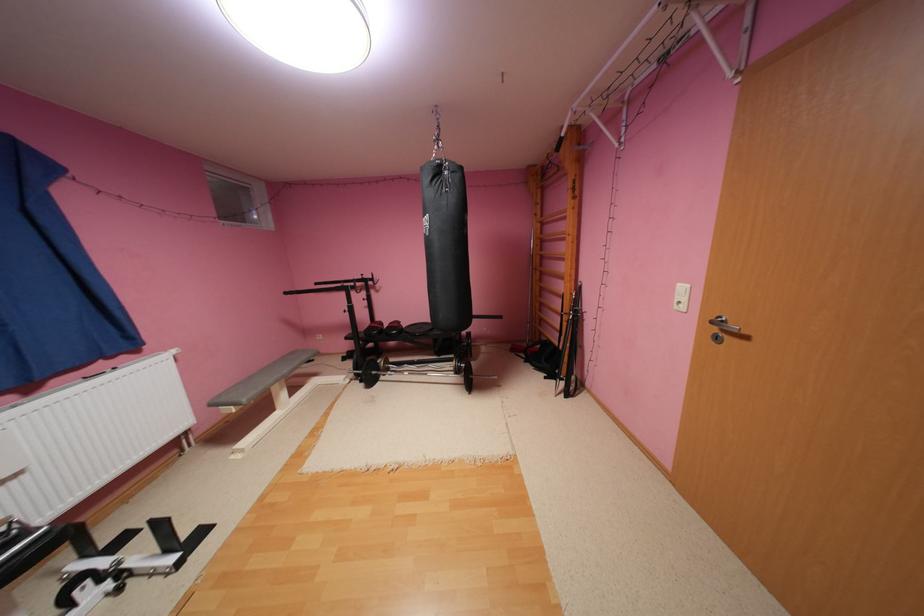
The width and height of the screenshot is (924, 616). I want to click on barbell with weights, so click(x=398, y=341).